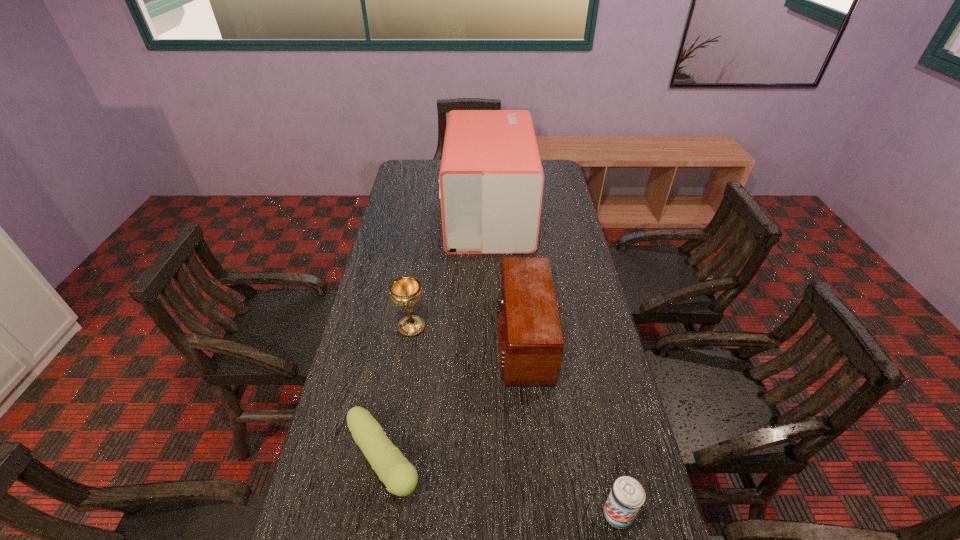
Where is `vacant space that is in between the chalice and the box`? The height and width of the screenshot is (540, 960). vacant space that is in between the chalice and the box is located at coordinates (450, 272).

Identify which object is the fourth closest to the fourth tallest object. Please provide its 2D coordinates. Your answer should be formatted as a tuple, i.e. [(x, y)], where the tuple contains the x and y coordinates of a point satisfying the conditions above.

[(491, 179)]

The image size is (960, 540). Identify the location of object that is the second closest to the rightmost object. (400, 477).

You are a GUI agent. You are given a task and a screenshot of the screen. Output one action in this format:
    pyautogui.click(x=<x>, y=<y>)
    Task: Click on the vacant space that satisfies the following two spatial constraints: 1. on the front-facing side of the rightmost object; 2. on the left side of the radio receiver
    This screenshot has height=540, width=960.
    Given the screenshot: What is the action you would take?
    pyautogui.click(x=539, y=514)

Locate an element on the screen. The width and height of the screenshot is (960, 540). vacant space that satisfies the following two spatial constraints: 1. on the surface of the tallest object where the text is embossed; 2. on the front side of the chalice is located at coordinates (492, 327).

I want to click on free space that satisfies the following two spatial constraints: 1. on the front-facing side of the radio receiver; 2. on the back side of the second shortest object, so click(539, 514).